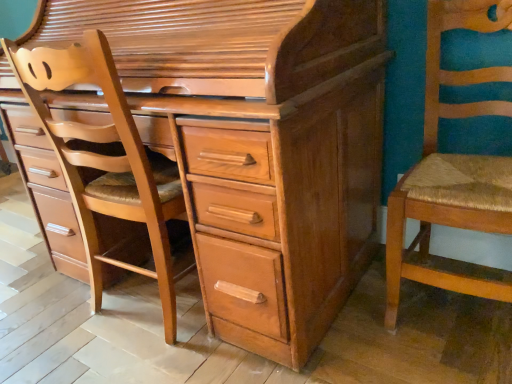
Question: Would you say light brown wood chest of drawers at center is outside wooden woven seat at right?

Choices:
 (A) no
 (B) yes

Answer: (B)

Question: Considering the relative sizes of light brown wood chest of drawers at center and wooden woven seat at right in the image provided, is light brown wood chest of drawers at center smaller than wooden woven seat at right?

Choices:
 (A) yes
 (B) no

Answer: (B)

Question: Does light brown wood chest of drawers at center have a lesser width compared to wooden woven seat at right?

Choices:
 (A) yes
 (B) no

Answer: (B)

Question: From a real-world perspective, does light brown wood chest of drawers at center sit lower than wooden woven seat at right?

Choices:
 (A) no
 (B) yes

Answer: (A)

Question: Does light brown wood chest of drawers at center appear on the left side of wooden woven seat at right?

Choices:
 (A) yes
 (B) no

Answer: (A)

Question: Visually, is light brown wood chest of drawers at center positioned to the left or to the right of light brown wood chair at left?

Choices:
 (A) left
 (B) right

Answer: (B)

Question: Is light brown wood chest of drawers at center spatially inside light brown wood chair at left, or outside of it?

Choices:
 (A) inside
 (B) outside

Answer: (B)

Question: Is light brown wood chest of drawers at center bigger or smaller than light brown wood chair at left?

Choices:
 (A) small
 (B) big

Answer: (B)

Question: From their relative heights in the image, would you say light brown wood chest of drawers at center is taller or shorter than light brown wood chair at left?

Choices:
 (A) short
 (B) tall

Answer: (B)

Question: Is wooden woven seat at right wider or thinner than light brown wood chest of drawers at center?

Choices:
 (A) thin
 (B) wide

Answer: (A)

Question: Does point (466, 4) appear closer or farther from the camera than point (275, 297)?

Choices:
 (A) closer
 (B) farther

Answer: (B)

Question: In terms of size, does wooden woven seat at right appear bigger or smaller than light brown wood chest of drawers at center?

Choices:
 (A) big
 (B) small

Answer: (B)

Question: From the image's perspective, is wooden woven seat at right above or below light brown wood chest of drawers at center?

Choices:
 (A) above
 (B) below

Answer: (B)

Question: Would you say light brown wood chest of drawers at center is inside or outside wooden woven seat at right?

Choices:
 (A) inside
 (B) outside

Answer: (B)

Question: From a real-world perspective, is light brown wood chest of drawers at center above or below wooden woven seat at right?

Choices:
 (A) above
 (B) below

Answer: (A)